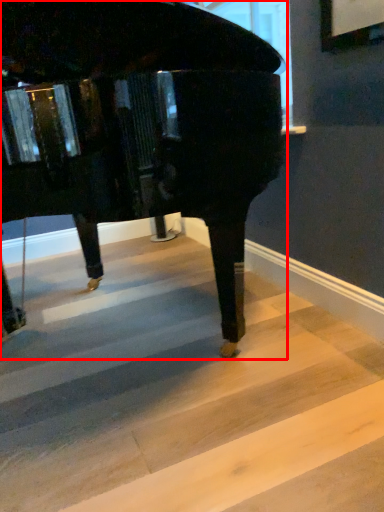
Question: Where is piano (annotated by the red box) located in relation to stairwell in the image?

Choices:
 (A) right
 (B) left

Answer: (B)